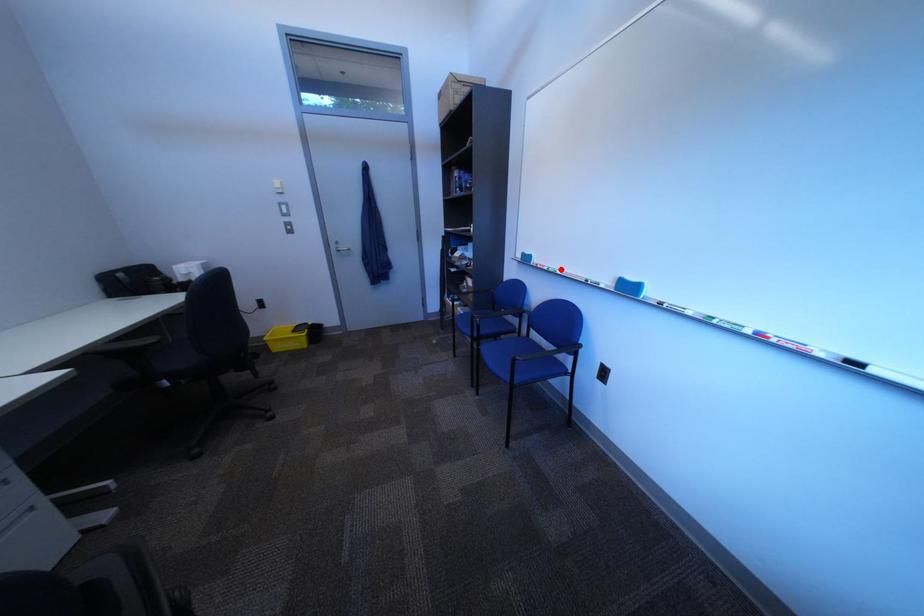
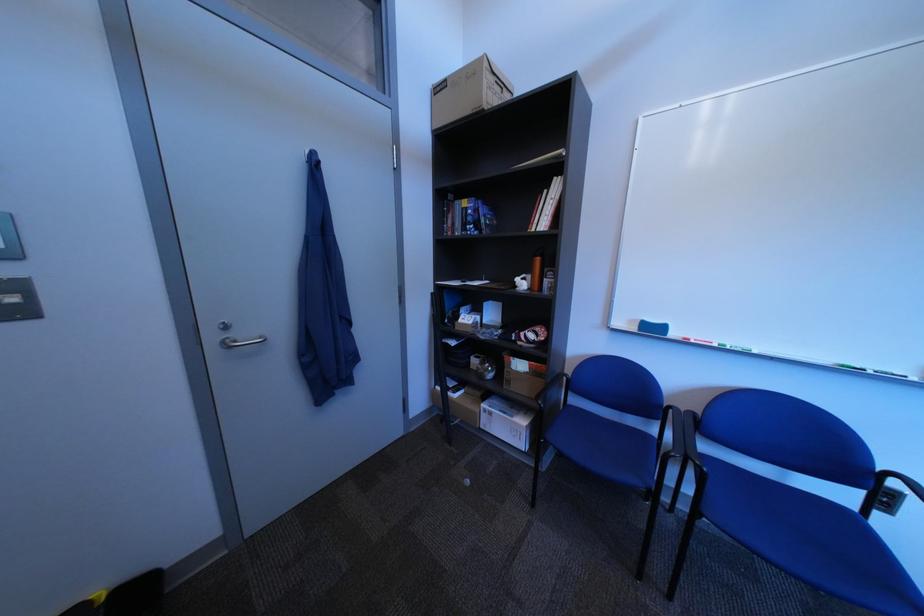
Locate, in the second image, the point that corresponds to the highlighted location in the first image.

(732, 347)